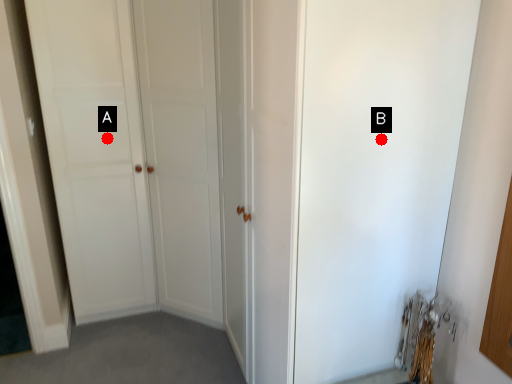
Question: Two points are circled on the image, labeled by A and B beside each circle. Which of the following is the closest to the observer?

Choices:
 (A) A is closer
 (B) B is closer

Answer: (B)